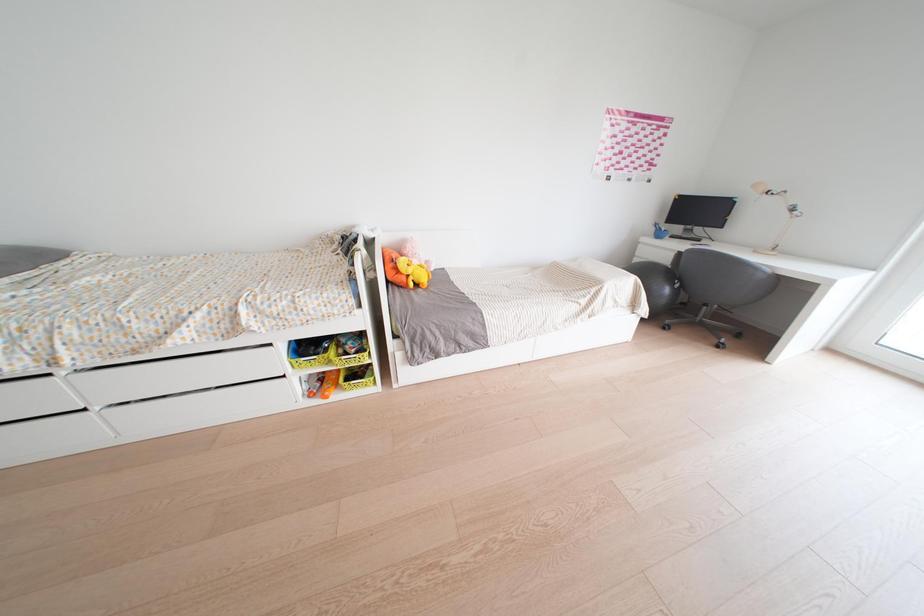
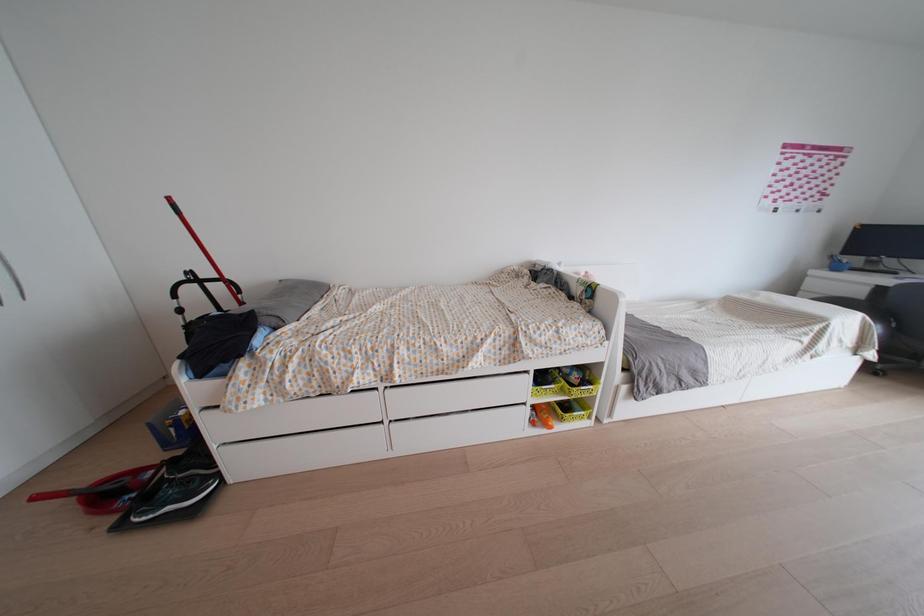
Question: Which direction would the cameraman need to move to produce the second image? Reply with the corresponding letter.

Choices:
 (A) Left
 (B) Right
 (C) Forward
 (D) Backward

Answer: (A)